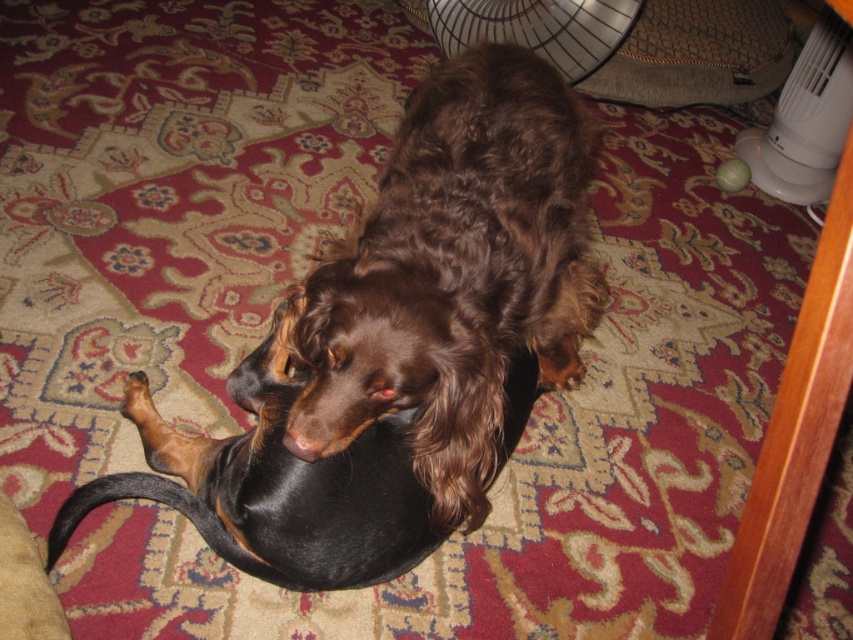
Does point (819, 108) lie in front of point (589, 26)?

Yes, it is.

Is white plastic fan at upper right below metallic silver fan at upper center?

Yes.

Is point (828, 84) closer to camera compared to point (590, 52)?

Yes, point (828, 84) is closer to viewer.

Image resolution: width=853 pixels, height=640 pixels. Identify the location of white plastic fan at upper right. (805, 120).

Does point (444, 212) come closer to viewer compared to point (535, 48)?

Yes.

Does brown furry dog at center come in front of metallic silver fan at upper center?

Yes, it is in front of metallic silver fan at upper center.

Does point (526, 157) lie behind point (543, 45)?

No, it is in front of (543, 45).

Locate an element on the screen. brown furry dog at center is located at coordinates (456, 275).

The width and height of the screenshot is (853, 640). What do you see at coordinates (456, 275) in the screenshot?
I see `brown furry dog at center` at bounding box center [456, 275].

Is point (339, 291) less distant than point (772, 168)?

Yes, point (339, 291) is in front of point (772, 168).

Identify the location of brown furry dog at center. (456, 275).